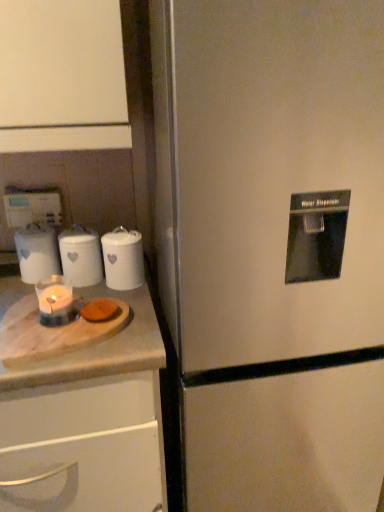
Question: Would you say brown matte cookie at lower left is part of white glossy canister at upper left, placed as the second kitchen appliance when sorted from left to right,'s contents?

Choices:
 (A) no
 (B) yes

Answer: (A)

Question: Does white glossy canister at upper left, positioned as the 1th kitchen appliance in right-to-left order, have a greater height compared to brown matte cookie at lower left?

Choices:
 (A) no
 (B) yes

Answer: (B)

Question: Is white glossy canister at upper left, placed as the second kitchen appliance when sorted from left to right, looking in the opposite direction of brown matte cookie at lower left?

Choices:
 (A) no
 (B) yes

Answer: (A)

Question: Considering the relative sizes of white glossy canister at upper left, positioned as the 1th kitchen appliance in right-to-left order, and brown matte cookie at lower left in the image provided, is white glossy canister at upper left, positioned as the 1th kitchen appliance in right-to-left order, wider than brown matte cookie at lower left?

Choices:
 (A) no
 (B) yes

Answer: (B)

Question: Does white glossy canister at upper left, positioned as the 1th kitchen appliance in right-to-left order, have a larger size compared to brown matte cookie at lower left?

Choices:
 (A) no
 (B) yes

Answer: (B)

Question: From a real-world perspective, relative to brown matte cookie at lower left, is white glossy candle at left vertically above or below?

Choices:
 (A) above
 (B) below

Answer: (A)

Question: From the image's perspective, is white glossy candle at left positioned above or below brown matte cookie at lower left?

Choices:
 (A) below
 (B) above

Answer: (B)

Question: Relative to brown matte cookie at lower left, is white glossy candle at left in front or behind?

Choices:
 (A) behind
 (B) front

Answer: (A)

Question: Would you say white glossy candle at left is to the left or to the right of brown matte cookie at lower left in the picture?

Choices:
 (A) right
 (B) left

Answer: (B)

Question: Considering their positions, is white marble cutting board at left located in front of or behind white marble tray at left?

Choices:
 (A) front
 (B) behind

Answer: (A)

Question: Considering the positions of white marble cutting board at left and white marble tray at left in the image, is white marble cutting board at left wider or thinner than white marble tray at left?

Choices:
 (A) thin
 (B) wide

Answer: (B)

Question: From a real-world perspective, is white marble cutting board at left positioned above or below white marble tray at left?

Choices:
 (A) below
 (B) above

Answer: (A)

Question: Considering the positions of point (14, 508) and point (150, 349), is point (14, 508) closer or farther from the camera than point (150, 349)?

Choices:
 (A) farther
 (B) closer

Answer: (A)

Question: From their relative heights in the image, would you say brown matte cookie at lower left is taller or shorter than white glossy candle at left?

Choices:
 (A) tall
 (B) short

Answer: (B)

Question: Is brown matte cookie at lower left inside or outside of white glossy candle at left?

Choices:
 (A) outside
 (B) inside

Answer: (A)